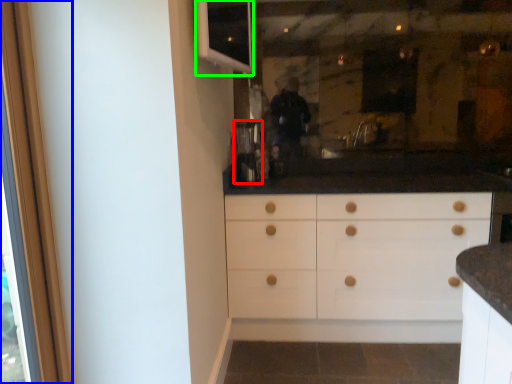
Question: Which object is positioned closest to coffee machine (highlighted by a red box)? Select from screen door (highlighted by a blue box) and window (highlighted by a green box).

Choices:
 (A) screen door
 (B) window

Answer: (B)